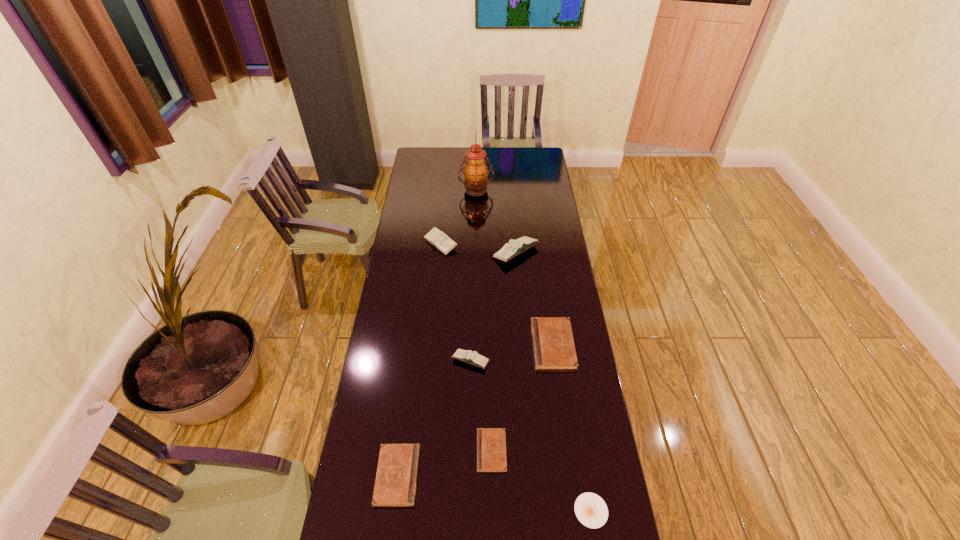
The image size is (960, 540). In order to click on vacant area in the image that satisfies the following two spatial constraints: 1. on the spine side of the rightmost brown diary; 2. on the right side of the shortest object in this screenshot , I will do `click(576, 511)`.

At what (x,y) coordinates should I click in order to perform the action: click on vacant region that satisfies the following two spatial constraints: 1. on the back side of the third tallest object; 2. on the right side of the oil lamp. Please return your answer as a coordinate pair (x, y). Looking at the image, I should click on pyautogui.click(x=445, y=190).